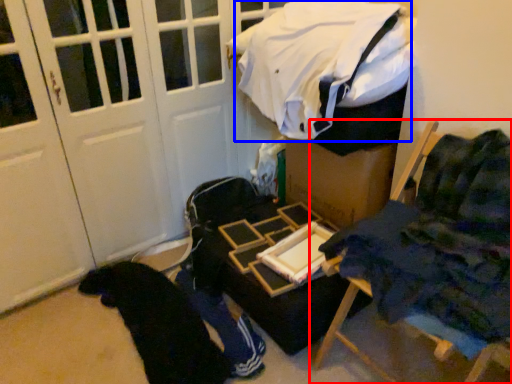
Question: Which object is further to the camera taking this photo, furniture (highlighted by a red box) or laundry (highlighted by a blue box)?

Choices:
 (A) furniture
 (B) laundry

Answer: (B)